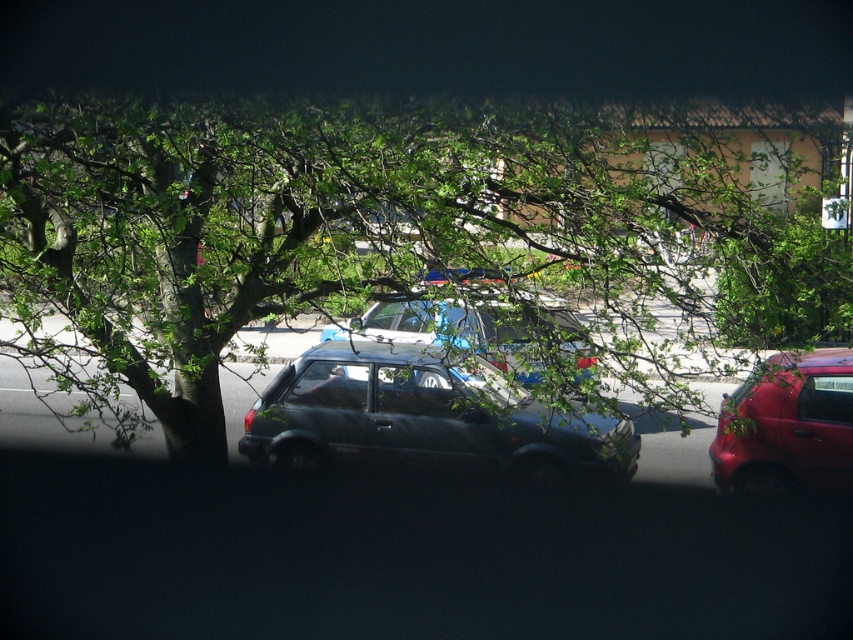
You are standing at point (404, 241) in the scene. What object is directly beneath your feet?

The green leafy tree at center is directly beneath the point (404, 241).

You are standing at the point marked by the coordinates (425, 417) in the image. What object are you touching?

The point at coordinates (425, 417) is on the shiny black minivan at center, so you are touching the shiny black minivan at center.